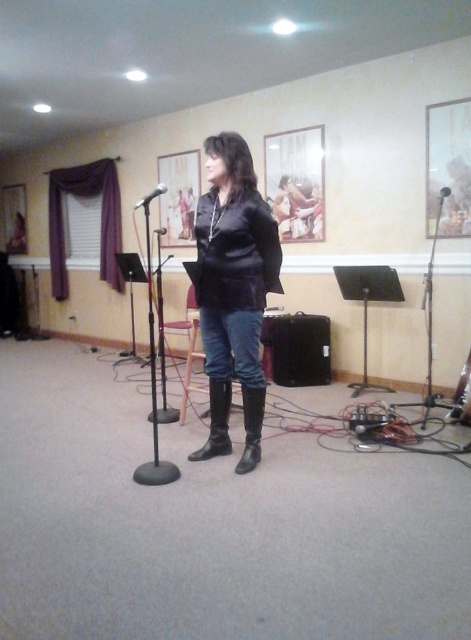
Can you confirm if matte black jacket at center is thinner than leather boots at center?

No, matte black jacket at center is not thinner than leather boots at center.

Can you confirm if matte black jacket at center is taller than leather boots at center?

Yes, matte black jacket at center is taller than leather boots at center.

Identify the location of matte black jacket at center. This screenshot has height=640, width=471. (234, 291).

This screenshot has width=471, height=640. What are the coordinates of `matte black jacket at center` in the screenshot? It's located at (234, 291).

Which of these two, transparent glass picture frame at upper right or wooden picture frame at left, stands taller?

wooden picture frame at left is taller.

From the picture: Is transparent glass picture frame at upper right to the right of wooden picture frame at left from the viewer's perspective?

Correct, you'll find transparent glass picture frame at upper right to the right of wooden picture frame at left.

Is point (464, 164) closer to viewer compared to point (9, 248)?

Yes, point (464, 164) is closer to viewer.

Identify the location of transparent glass picture frame at upper right. (448, 168).

What do you see at coordinates (295, 182) in the screenshot?
I see `metallic silver picture frame at upper center` at bounding box center [295, 182].

Is point (316, 129) in front of point (308, 360)?

No, (316, 129) is further to viewer.

Does point (284, 230) lie behind point (284, 346)?

Yes, it is.

Image resolution: width=471 pixels, height=640 pixels. Identify the location of metallic silver picture frame at upper center. (295, 182).